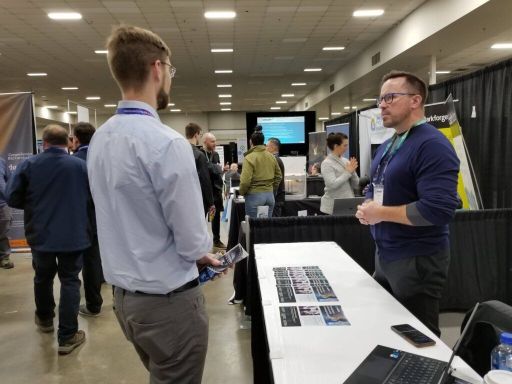
Identify the location of laptop. The height and width of the screenshot is (384, 512). (390, 365).